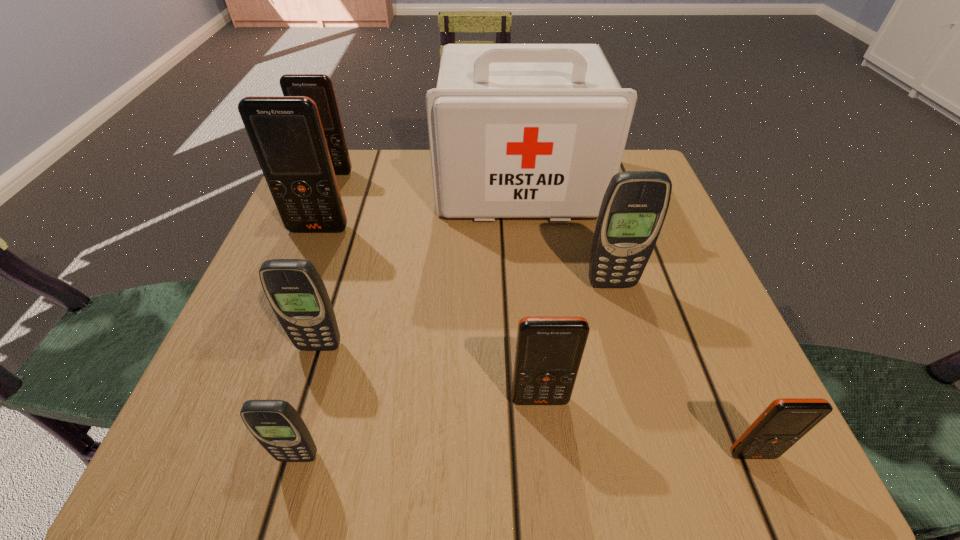
Locate an element on the screen. This screenshot has width=960, height=540. white first-aid kit is located at coordinates (515, 130).

Identify the location of the biggest orange cellular telephone. (286, 132).

The width and height of the screenshot is (960, 540). Identify the location of the second farthest orange cellular telephone. (286, 132).

Locate an element on the screen. Image resolution: width=960 pixels, height=540 pixels. the third smallest orange cellular telephone is located at coordinates (319, 87).

What are the coordinates of `the farthest orange cellular telephone` in the screenshot? It's located at (319, 87).

Identify the location of the sixth cellular telephone from left to right. (635, 204).

Locate an element on the screen. This screenshot has width=960, height=540. the rightmost gray cellular telephone is located at coordinates (635, 204).

Identify the location of the fourth farthest cellular telephone. (294, 288).

Locate an element on the screen. the fourth nearest object is located at coordinates (294, 288).

The width and height of the screenshot is (960, 540). What are the coordinates of `the fifth farthest cellular telephone` in the screenshot? It's located at (549, 349).